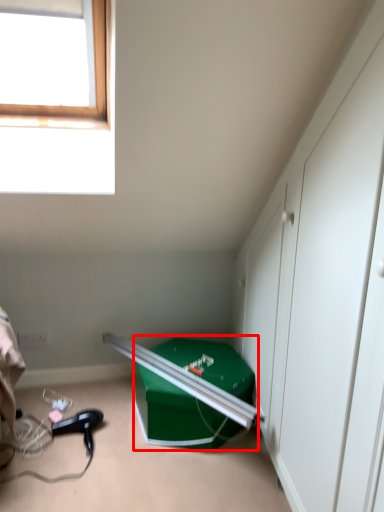
Question: From the image's perspective, where is box (annotated by the red box) located in relation to hair drier in the image?

Choices:
 (A) below
 (B) above

Answer: (B)